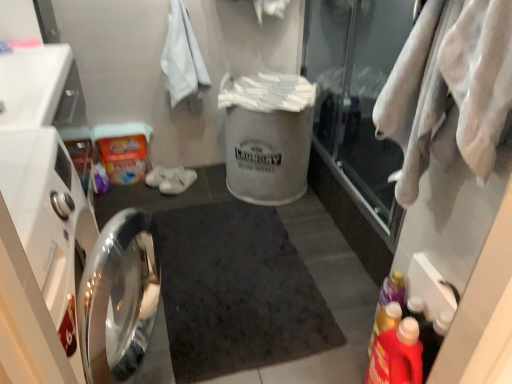
Question: Is red plastic detergent at lower right, which appears as the first bottle when viewed from the front, smaller than polished stainless steel dishwasher at left?

Choices:
 (A) yes
 (B) no

Answer: (A)

Question: From the image's perspective, does red plastic detergent at lower right, which appears as the first bottle when viewed from the front, appear lower than polished stainless steel dishwasher at left?

Choices:
 (A) no
 (B) yes

Answer: (B)

Question: Can you confirm if red plastic detergent at lower right, the second bottle in the back-to-front sequence, is shorter than polished stainless steel dishwasher at left?

Choices:
 (A) no
 (B) yes

Answer: (B)

Question: Is red plastic detergent at lower right, the second bottle in the back-to-front sequence, next to polished stainless steel dishwasher at left?

Choices:
 (A) no
 (B) yes

Answer: (A)

Question: Is red plastic detergent at lower right, the second bottle in the back-to-front sequence, facing away from polished stainless steel dishwasher at left?

Choices:
 (A) no
 (B) yes

Answer: (A)

Question: Does red plastic detergent at lower right, the second bottle in the back-to-front sequence, appear on the right side of polished stainless steel dishwasher at left?

Choices:
 (A) yes
 (B) no

Answer: (A)

Question: Can you confirm if white cotton bath towel at upper left is bigger than white cotton towel at right?

Choices:
 (A) yes
 (B) no

Answer: (B)

Question: Does white cotton bath towel at upper left have a lesser height compared to white cotton towel at right?

Choices:
 (A) no
 (B) yes

Answer: (A)

Question: Is the surface of white cotton bath towel at upper left in direct contact with white cotton towel at right?

Choices:
 (A) yes
 (B) no

Answer: (B)

Question: Does white cotton bath towel at upper left have a smaller size compared to white cotton towel at right?

Choices:
 (A) yes
 (B) no

Answer: (A)

Question: Is white cotton bath towel at upper left not within white cotton towel at right?

Choices:
 (A) no
 (B) yes

Answer: (B)

Question: Considering the relative positions of white cotton bath towel at upper left and white cotton towel at right in the image provided, is white cotton bath towel at upper left to the left of white cotton towel at right from the viewer's perspective?

Choices:
 (A) yes
 (B) no

Answer: (A)

Question: Can you confirm if transparent glass door at upper right is bigger than white cotton bath towel at upper left?

Choices:
 (A) yes
 (B) no

Answer: (A)